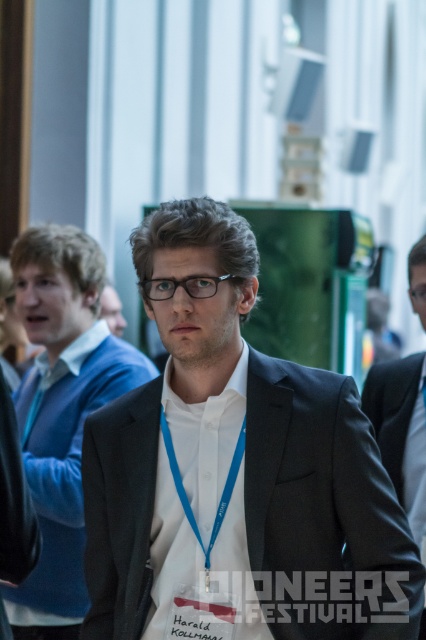
Who is positioned more to the left, black matte suit at center or black suit at center?

black matte suit at center

Which is below, black matte suit at center or black suit at center?

black suit at center

Find the location of a particular element. The width and height of the screenshot is (426, 640). black matte suit at center is located at coordinates (244, 513).

Is dark gray suit at center closer to the viewer compared to black suit at center?

No, dark gray suit at center is further to the viewer.

Locate an element on the screen. The image size is (426, 640). dark gray suit at center is located at coordinates (62, 413).

Can you confirm if skinny white shirt at center is bigger than matte black suit at center?

Incorrect, skinny white shirt at center is not larger than matte black suit at center.

Does skinny white shirt at center appear under matte black suit at center?

Yes.

Measure the distance between point (215, 394) and camera.

6.02 meters

Where is `skinny white shirt at center`? Image resolution: width=426 pixels, height=640 pixels. skinny white shirt at center is located at coordinates (201, 360).